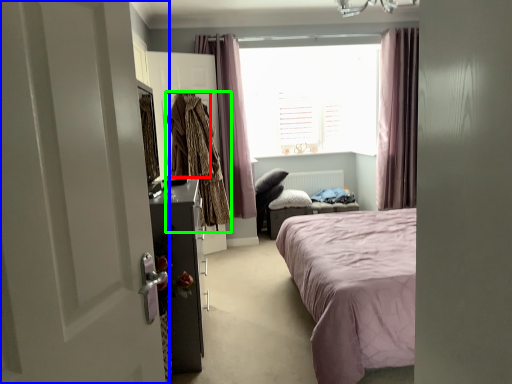
Question: Considering the real-world distances, which object is closest to clothing (highlighted by a red box)? door (highlighted by a blue box) or clothing (highlighted by a green box).

Choices:
 (A) door
 (B) clothing

Answer: (B)